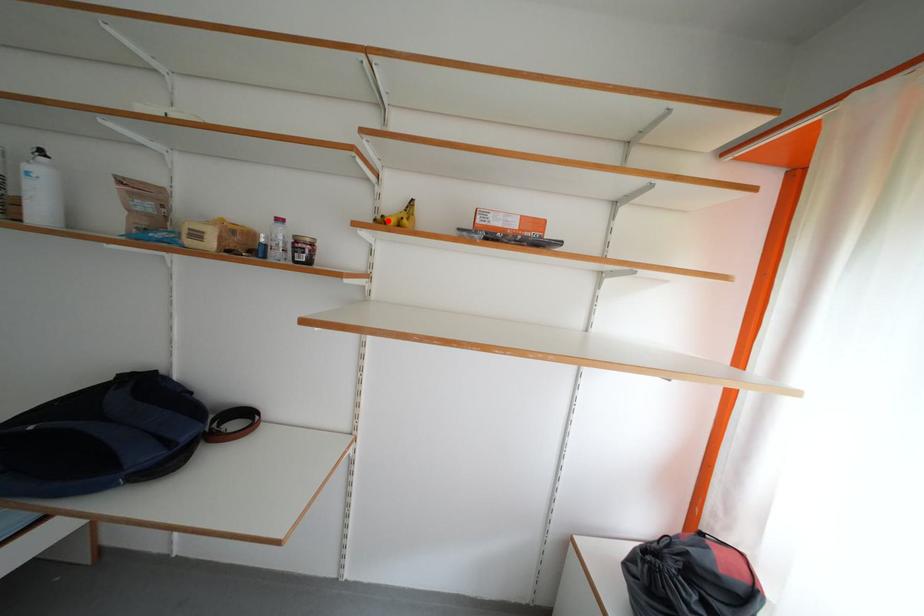
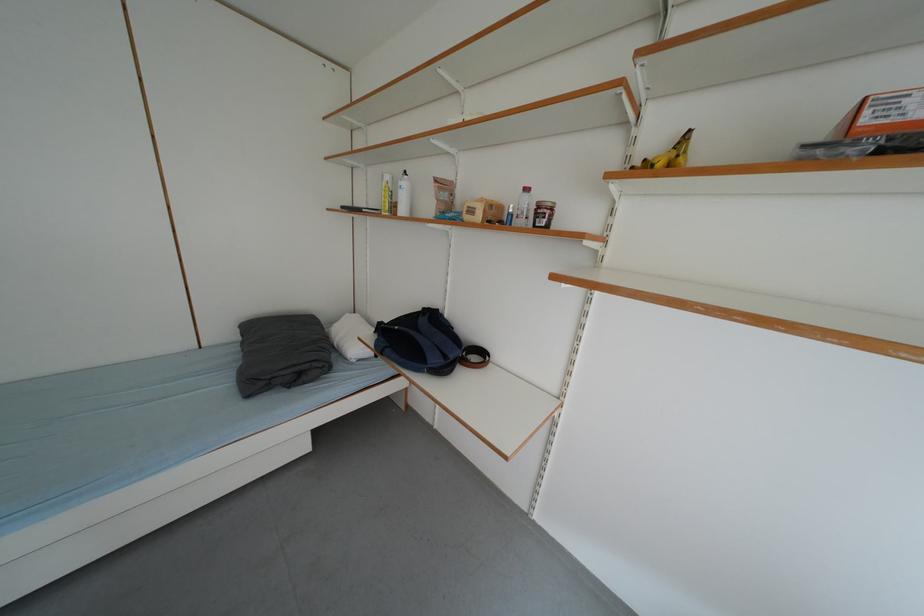
Locate, in the second image, the point that corresponds to the highlighted location in the first image.

(648, 167)